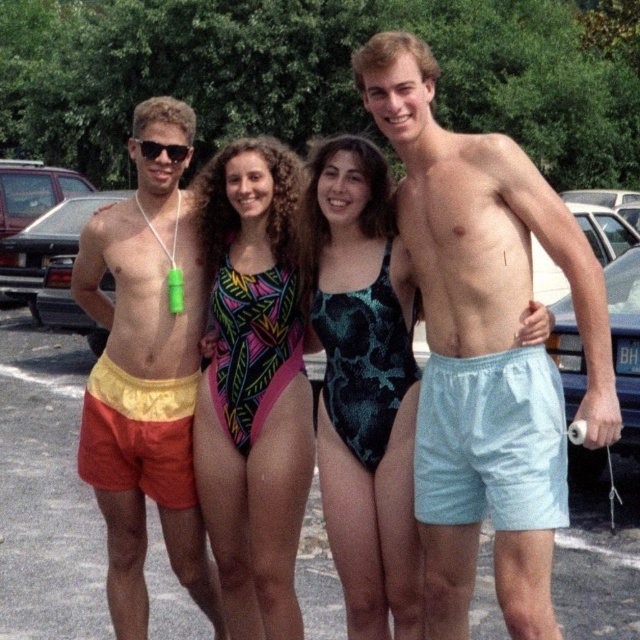
You are a photographer trying to capture a photo of the neon geometric swimsuit at center and the black plastic sunglasses at left. Which object should you focus on first if you want to ensure both are in the frame without moving the camera?

The neon geometric swimsuit at center is taller than the black plastic sunglasses at left, so you should focus on the neon geometric swimsuit at center first to ensure it fits within the frame, then adjust for the smaller black plastic sunglasses at left.